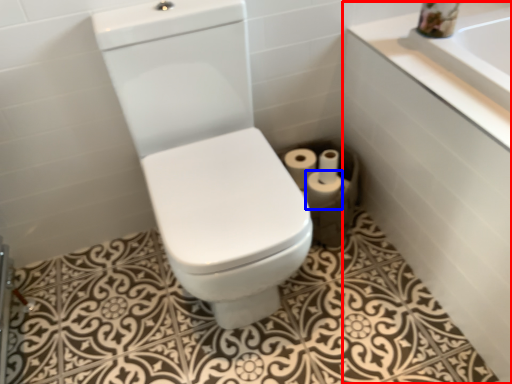
Question: Which point is closer to the camera, bath (highlighted by a red box) or toilet paper (highlighted by a blue box)?

Choices:
 (A) bath
 (B) toilet paper

Answer: (A)